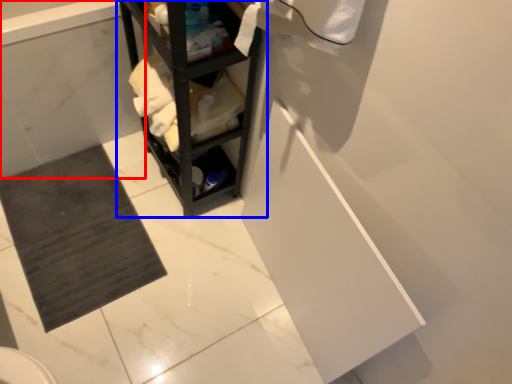
Question: Which object appears farthest to the camera in this image, bath (highlighted by a red box) or shelf (highlighted by a blue box)?

Choices:
 (A) bath
 (B) shelf

Answer: (A)